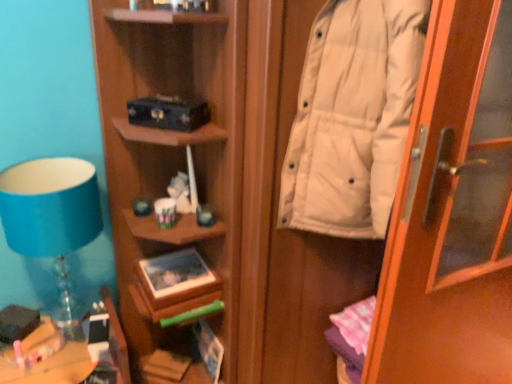
You are a GUI agent. You are given a task and a screenshot of the screen. Output one action in this format:
    pyautogui.click(x=<x>, y=<y>)
    Task: Click on the free location above matte green book at center, the 2th book from the top (from a real-world perspective)
    Image resolution: width=512 pixels, height=384 pixels.
    Given the screenshot: What is the action you would take?
    pyautogui.click(x=176, y=259)